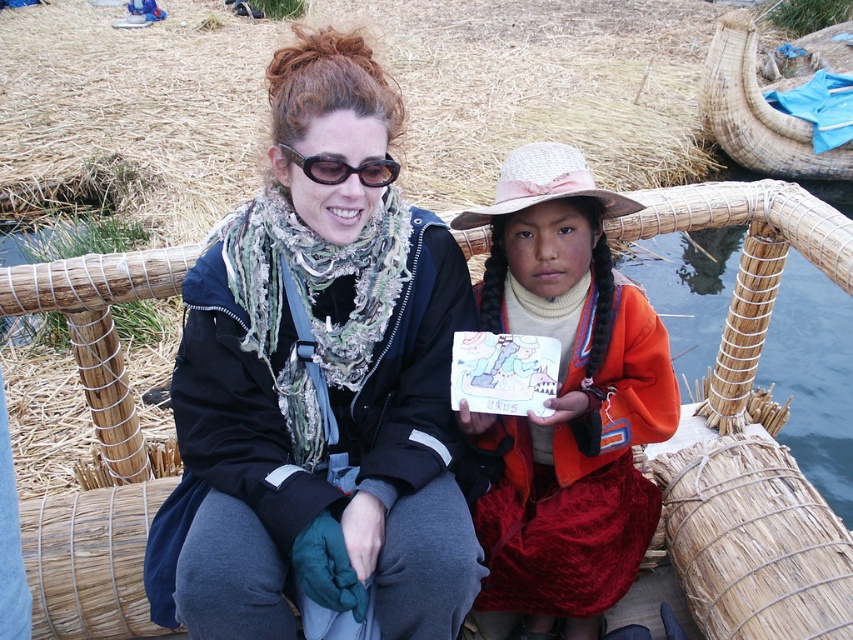
You are a photographer trying to capture a wide shot of the woven straw boat at center and the black plastic sunglasses at upper center. Since you want both objects to be clearly visible in the frame, which object should you focus on first to ensure proper framing?

The woven straw boat at center is wider than the black plastic sunglasses at upper center, so you should focus on the woven straw boat at center first to ensure it fits properly in the frame before adjusting for the smaller sunglasses.

Based on the photo, you are a photographer trying to capture a closeup of the black plastic sunglasses at upper center while standing on the woven straw boat at center. Given that your camera has a minimum focusing distance of 1 meter, can you take the photo without moving either object?

The woven straw boat at center is 1.38 meters from the black plastic sunglasses at upper center. Since the distance is greater than the camera minimum focusing distance of 1 meter, you can take the photo without moving either object.